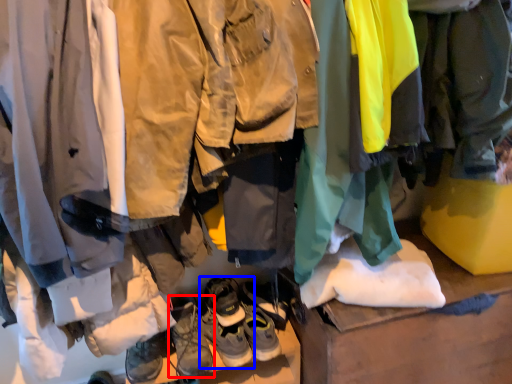
Question: Which point is further to the camera, footwear (highlighted by a red box) or footwear (highlighted by a blue box)?

Choices:
 (A) footwear
 (B) footwear

Answer: (B)